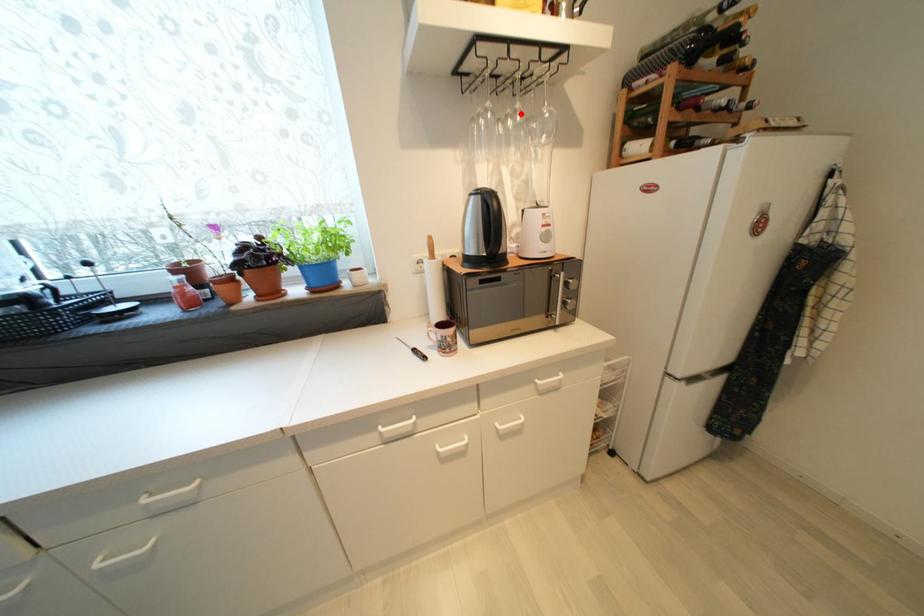
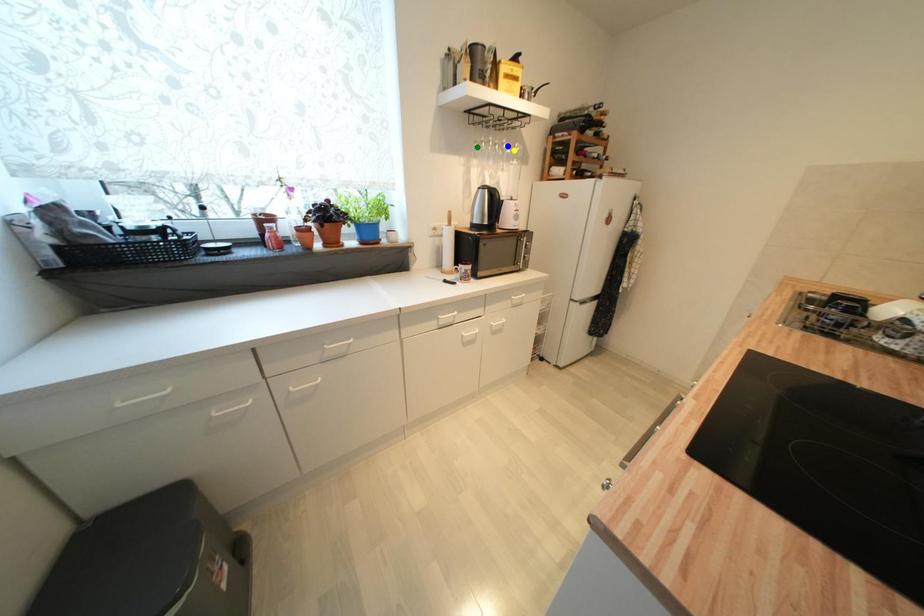
Question: I am providing you with two images of the same scene from different viewpoints. A red point is marked on the first image. You are given multiple points on the second image. Which point in image 2 is actually the same real-world point as the red point in image 1?

Choices:
 (A) green point
 (B) blue point
 (C) yellow point

Answer: (B)